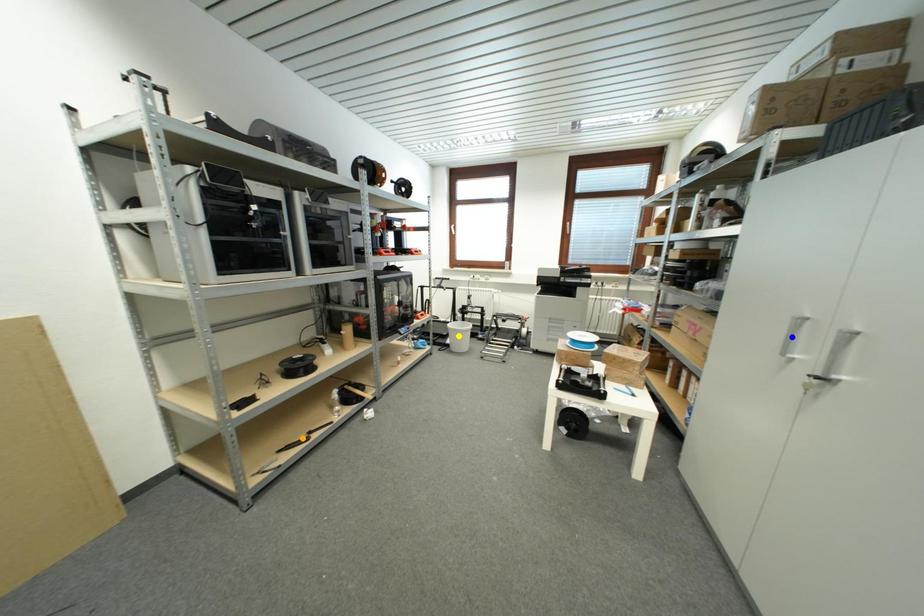
Order these from nearest to farthest:
yellow point, orange point, blue point

blue point
orange point
yellow point